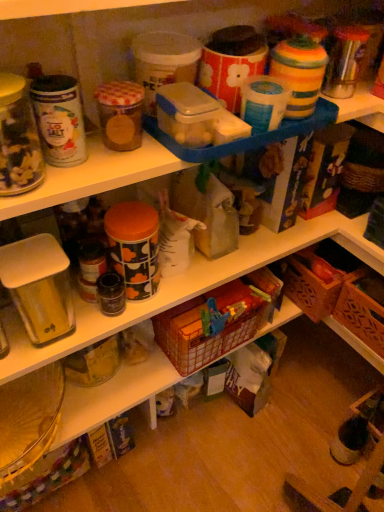
How much space does brown woven basket at lower right, positioned as the 1th basket in right-to-left order, occupy vertically?

It is 6.63 inches.

This screenshot has height=512, width=384. Describe the element at coordinates (363, 308) in the screenshot. I see `brown woven basket at lower right, positioned as the 1th basket in right-to-left order` at that location.

Identify the location of brown woven basket at lower right, positioned as the 1th basket in right-to-left order. (363, 308).

Describe the element at coordinates (209, 325) in the screenshot. The height and width of the screenshot is (512, 384). I see `plastic woven basket at center, the second basket when ordered from right to left` at that location.

At what (x,y) coordinates should I click in order to perform the action: click on plastic woven basket at center, marked as the first basket in a left-to-right arrangement. Please return your answer as a coordinate pair (x, y). Looking at the image, I should click on (209, 325).

Find the location of a particular element. The image size is (384, 512). brown woven basket at lower right, arranged as the 2th basket when viewed from the left is located at coordinates (363, 308).

Between brown woven basket at lower right, arranged as the 2th basket when viewed from the left, and plastic woven basket at center, the second basket when ordered from right to left, which one appears on the right side from the viewer's perspective?

brown woven basket at lower right, arranged as the 2th basket when viewed from the left, is more to the right.

Considering their positions, is brown woven basket at lower right, positioned as the 1th basket in right-to-left order, located in front of or behind plastic woven basket at center, the second basket when ordered from right to left?

Visually, brown woven basket at lower right, positioned as the 1th basket in right-to-left order, is located behind plastic woven basket at center, the second basket when ordered from right to left.

Does point (351, 287) come closer to viewer compared to point (211, 333)?

That is False.

From the image's perspective, who appears lower, brown woven basket at lower right, positioned as the 1th basket in right-to-left order, or plastic woven basket at center, marked as the first basket in a left-to-right arrangement?

plastic woven basket at center, marked as the first basket in a left-to-right arrangement, appears lower in the image.

From a real-world perspective, is brown woven basket at lower right, positioned as the 1th basket in right-to-left order, physically located above or below plastic woven basket at center, marked as the first basket in a left-to-right arrangement?

In terms of real-world spatial position, brown woven basket at lower right, positioned as the 1th basket in right-to-left order, is below plastic woven basket at center, marked as the first basket in a left-to-right arrangement.

In the scene shown: Between brown woven basket at lower right, arranged as the 2th basket when viewed from the left, and plastic woven basket at center, the second basket when ordered from right to left, which one has smaller width?

Thinner between the two is plastic woven basket at center, the second basket when ordered from right to left.

In terms of height, does brown woven basket at lower right, arranged as the 2th basket when viewed from the left, look taller or shorter compared to plastic woven basket at center, marked as the first basket in a left-to-right arrangement?

Considering their sizes, brown woven basket at lower right, arranged as the 2th basket when viewed from the left, has less height than plastic woven basket at center, marked as the first basket in a left-to-right arrangement.

Who is smaller, brown woven basket at lower right, arranged as the 2th basket when viewed from the left, or plastic woven basket at center, marked as the first basket in a left-to-right arrangement?

brown woven basket at lower right, arranged as the 2th basket when viewed from the left.

Is brown woven basket at lower right, positioned as the 1th basket in right-to-left order, situated inside plastic woven basket at center, the second basket when ordered from right to left, or outside?

brown woven basket at lower right, positioned as the 1th basket in right-to-left order, lies outside plastic woven basket at center, the second basket when ordered from right to left.

Is brown woven basket at lower right, arranged as the 2th basket when viewed from the left, placed right next to plastic woven basket at center, marked as the first basket in a left-to-right arrangement?

No, brown woven basket at lower right, arranged as the 2th basket when viewed from the left, is not next to plastic woven basket at center, marked as the first basket in a left-to-right arrangement.

Could you tell me if brown woven basket at lower right, positioned as the 1th basket in right-to-left order, is turned towards plastic woven basket at center, marked as the first basket in a left-to-right arrangement?

Yes, brown woven basket at lower right, positioned as the 1th basket in right-to-left order, faces towards plastic woven basket at center, marked as the first basket in a left-to-right arrangement.

What's the angular difference between brown woven basket at lower right, positioned as the 1th basket in right-to-left order, and plastic woven basket at center, marked as the first basket in a left-to-right arrangement,'s facing directions?

89.1 degrees.

Measure the distance from brown woven basket at lower right, arranged as the 2th basket when viewed from the left, to plastic woven basket at center, the second basket when ordered from right to left.

brown woven basket at lower right, arranged as the 2th basket when viewed from the left, is 37.42 centimeters away from plastic woven basket at center, the second basket when ordered from right to left.

Locate an element on the screen. Image resolution: width=384 pixels, height=512 pixels. basket above the brown woven basket at lower right, positioned as the 1th basket in right-to-left order (from a real-world perspective) is located at coordinates (209, 325).

Considering the relative positions of plastic woven basket at center, the second basket when ordered from right to left, and brown woven basket at lower right, positioned as the 1th basket in right-to-left order, in the image provided, is plastic woven basket at center, the second basket when ordered from right to left, to the right of brown woven basket at lower right, positioned as the 1th basket in right-to-left order, from the viewer's perspective?

Incorrect, plastic woven basket at center, the second basket when ordered from right to left, is not on the right side of brown woven basket at lower right, positioned as the 1th basket in right-to-left order.

Is the depth of plastic woven basket at center, marked as the first basket in a left-to-right arrangement, less than that of brown woven basket at lower right, positioned as the 1th basket in right-to-left order?

Yes, it is in front of brown woven basket at lower right, positioned as the 1th basket in right-to-left order.

Which is further, (x=220, y=334) or (x=349, y=289)?

Positioned behind is point (x=349, y=289).

From the image's perspective, is plastic woven basket at center, marked as the first basket in a left-to-right arrangement, on top of brown woven basket at lower right, arranged as the 2th basket when viewed from the left?

Incorrect, from the image's perspective, plastic woven basket at center, marked as the first basket in a left-to-right arrangement, is lower than brown woven basket at lower right, arranged as the 2th basket when viewed from the left.

From a real-world perspective, between plastic woven basket at center, marked as the first basket in a left-to-right arrangement, and brown woven basket at lower right, arranged as the 2th basket when viewed from the left, who is vertically lower?

In real-world perspective, brown woven basket at lower right, arranged as the 2th basket when viewed from the left, is lower.

Is plastic woven basket at center, marked as the first basket in a left-to-right arrangement, wider or thinner than brown woven basket at lower right, arranged as the 2th basket when viewed from the left?

Clearly, plastic woven basket at center, marked as the first basket in a left-to-right arrangement, has less width compared to brown woven basket at lower right, arranged as the 2th basket when viewed from the left.

In terms of height, does plastic woven basket at center, the second basket when ordered from right to left, look taller or shorter compared to brown woven basket at lower right, arranged as the 2th basket when viewed from the left?

In the image, plastic woven basket at center, the second basket when ordered from right to left, appears to be taller than brown woven basket at lower right, arranged as the 2th basket when viewed from the left.

Considering the relative sizes of plastic woven basket at center, marked as the first basket in a left-to-right arrangement, and brown woven basket at lower right, arranged as the 2th basket when viewed from the left, in the image provided, is plastic woven basket at center, marked as the first basket in a left-to-right arrangement, smaller than brown woven basket at lower right, arranged as the 2th basket when viewed from the left,?

Actually, plastic woven basket at center, marked as the first basket in a left-to-right arrangement, might be larger than brown woven basket at lower right, arranged as the 2th basket when viewed from the left.

Does plastic woven basket at center, the second basket when ordered from right to left, contain brown woven basket at lower right, arranged as the 2th basket when viewed from the left?

That's incorrect, brown woven basket at lower right, arranged as the 2th basket when viewed from the left, is not inside plastic woven basket at center, the second basket when ordered from right to left.

Is plastic woven basket at center, the second basket when ordered from right to left, next to brown woven basket at lower right, arranged as the 2th basket when viewed from the left, and touching it?

No, plastic woven basket at center, the second basket when ordered from right to left, is not with brown woven basket at lower right, arranged as the 2th basket when viewed from the left.

Is plastic woven basket at center, marked as the first basket in a left-to-right arrangement, aimed at brown woven basket at lower right, positioned as the 1th basket in right-to-left order?

No, plastic woven basket at center, marked as the first basket in a left-to-right arrangement, is not facing towards brown woven basket at lower right, positioned as the 1th basket in right-to-left order.

Image resolution: width=384 pixels, height=512 pixels. I want to click on basket positioned vertically above the brown woven basket at lower right, positioned as the 1th basket in right-to-left order (from a real-world perspective), so click(209, 325).

Identify the location of basket that is behind the plastic woven basket at center, marked as the first basket in a left-to-right arrangement. (363, 308).

Image resolution: width=384 pixels, height=512 pixels. What are the coordinates of `basket that appears above the brown woven basket at lower right, arranged as the 2th basket when viewed from the left (from a real-world perspective)` in the screenshot? It's located at (209, 325).